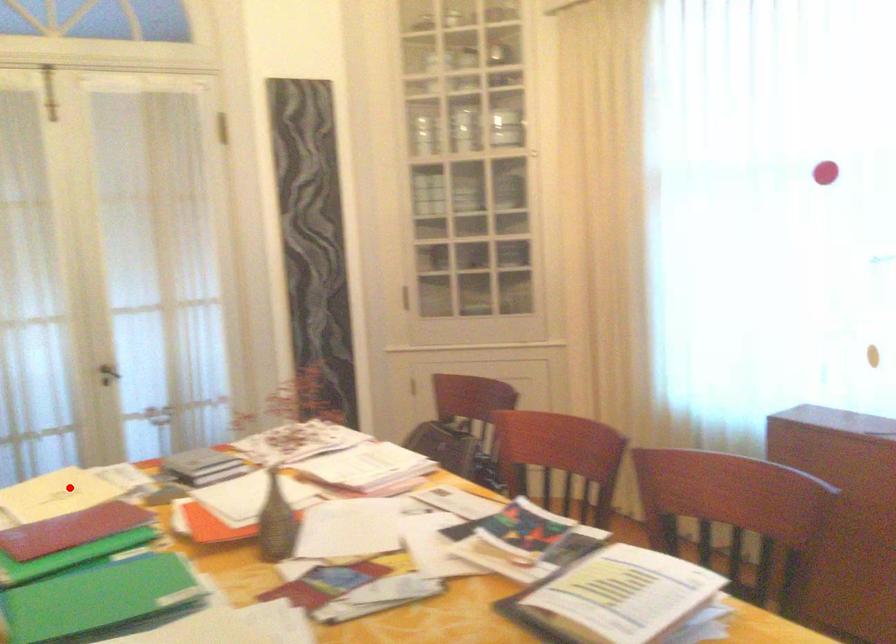
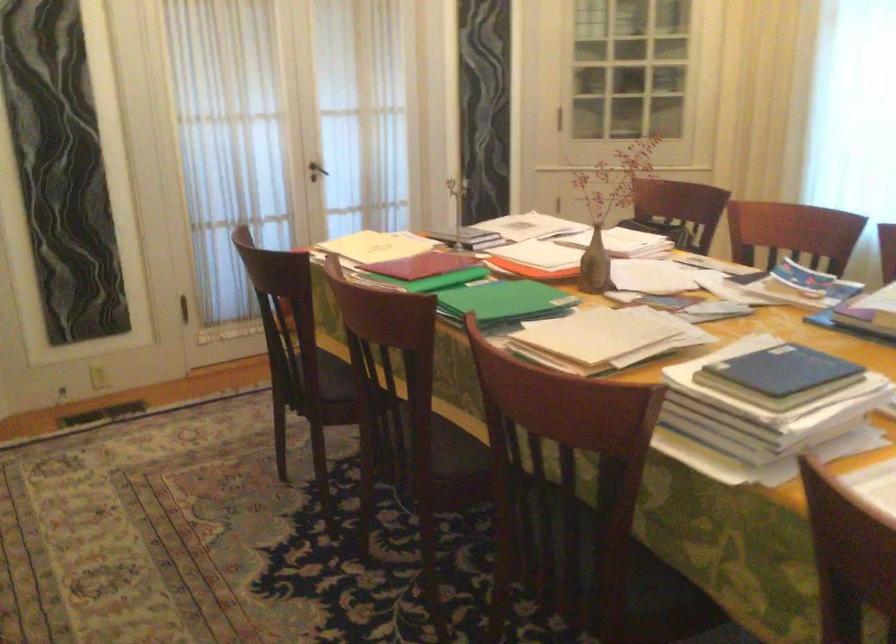
In the second image, find the point that corresponds to the highlighted location in the first image.

(376, 245)